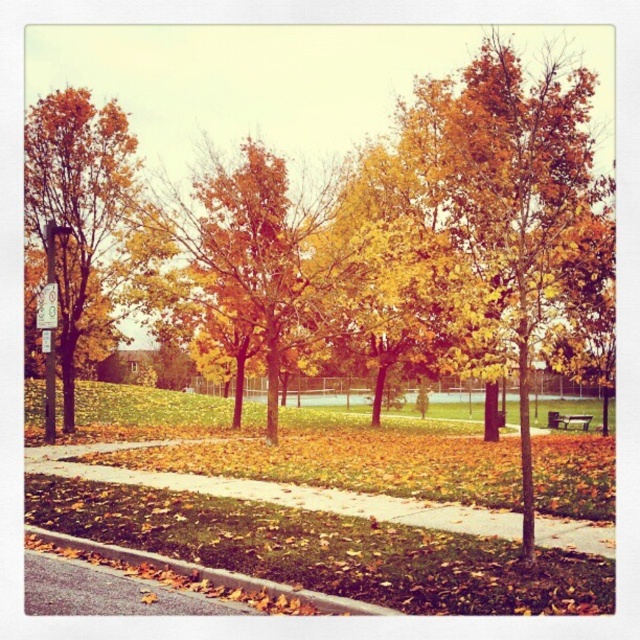
Can you confirm if golden yellow leaves at left is shorter than gray asphalt pavement at lower left?

No.

Can you confirm if golden yellow leaves at left is positioned to the right of gray asphalt pavement at lower left?

No, golden yellow leaves at left is not to the right of gray asphalt pavement at lower left.

You are a GUI agent. You are given a task and a screenshot of the screen. Output one action in this format:
    pyautogui.click(x=<x>, y=<y>)
    Task: Click on the golden yellow leaves at left
    Image resolution: width=640 pixels, height=640 pixels.
    Given the screenshot: What is the action you would take?
    pyautogui.click(x=77, y=212)

This screenshot has height=640, width=640. I want to click on golden yellow leaves at left, so click(x=77, y=212).

Does brown asphalt curb at lower left appear on the left side of wooden park bench at center?

Yes, brown asphalt curb at lower left is to the left of wooden park bench at center.

Is brown asphalt curb at lower left shorter than wooden park bench at center?

Indeed, brown asphalt curb at lower left has a lesser height compared to wooden park bench at center.

At what (x,y) coordinates should I click in order to perform the action: click on brown asphalt curb at lower left. Please return your answer as a coordinate pair (x, y). Looking at the image, I should click on (211, 573).

Which is more to the left, gray asphalt pavement at lower left or wooden park bench at center?

Positioned to the left is gray asphalt pavement at lower left.

Between gray asphalt pavement at lower left and wooden park bench at center, which one appears on the right side from the viewer's perspective?

From the viewer's perspective, wooden park bench at center appears more on the right side.

Is point (157, 600) farther from camera compared to point (577, 420)?

No, (157, 600) is in front of (577, 420).

The width and height of the screenshot is (640, 640). I want to click on gray asphalt pavement at lower left, so click(x=106, y=593).